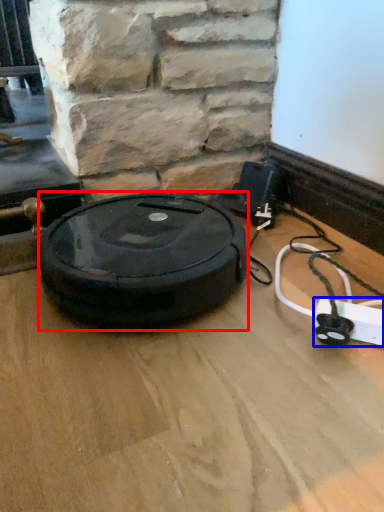
Question: Which object is further to the camera taking this photo, car tire (highlighted by a red box) or extension cord (highlighted by a blue box)?

Choices:
 (A) car tire
 (B) extension cord

Answer: (A)